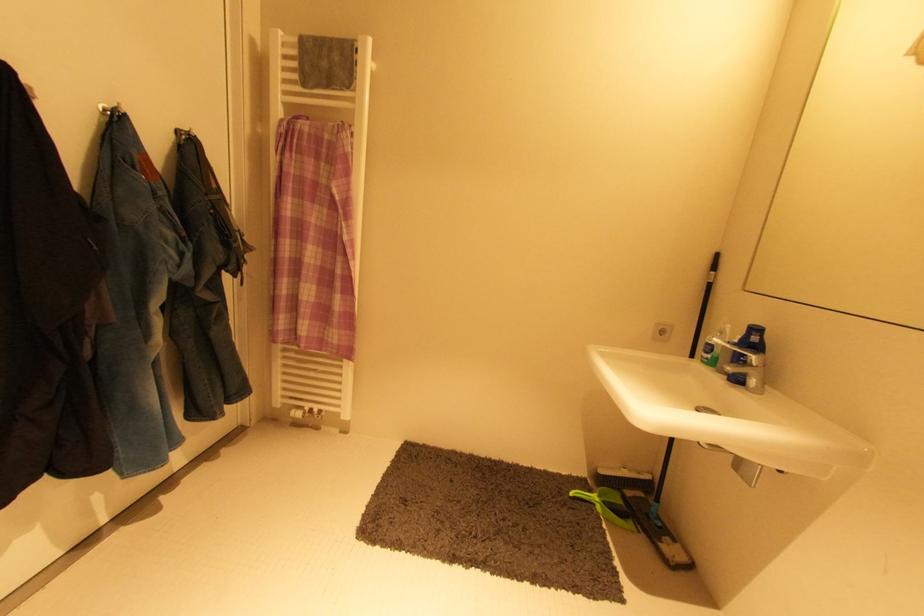
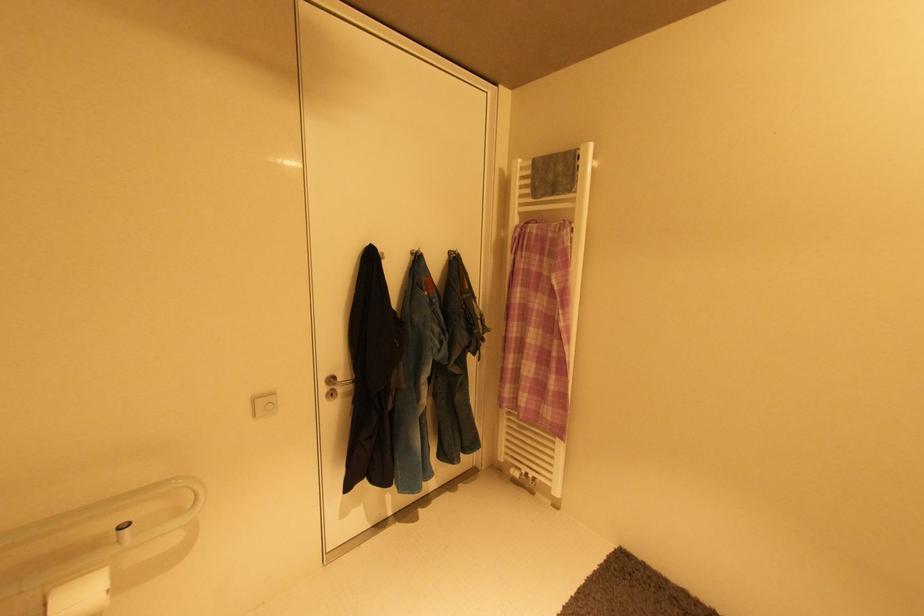
Question: The first image is from the beginning of the video and the second image is from the end. How did the camera likely rotate when shooting the video?

Choices:
 (A) Left
 (B) Right
 (C) Up
 (D) Down

Answer: (A)